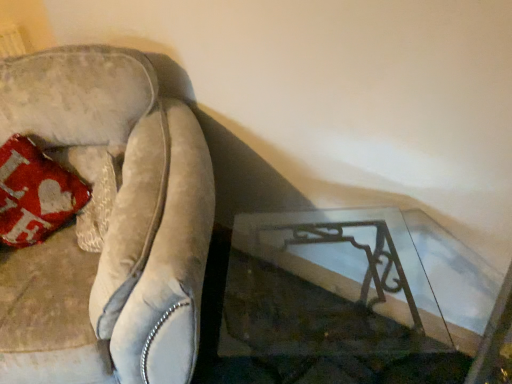
Question: From a real-world perspective, relative to clear glass table at lower right, is velvet couch at left vertically above or below?

Choices:
 (A) above
 (B) below

Answer: (A)

Question: Visually, is velvet couch at left positioned to the left or to the right of clear glass table at lower right?

Choices:
 (A) left
 (B) right

Answer: (A)

Question: Looking at the image, does velvet couch at left seem bigger or smaller compared to clear glass table at lower right?

Choices:
 (A) small
 (B) big

Answer: (B)

Question: Is clear glass table at lower right to the left or to the right of velvet couch at left in the image?

Choices:
 (A) right
 (B) left

Answer: (A)

Question: Considering the positions of clear glass table at lower right and velvet couch at left in the image, is clear glass table at lower right bigger or smaller than velvet couch at left?

Choices:
 (A) small
 (B) big

Answer: (A)

Question: From a real-world perspective, relative to velvet couch at left, is clear glass table at lower right vertically above or below?

Choices:
 (A) above
 (B) below

Answer: (B)

Question: Considering the positions of clear glass table at lower right and velvet couch at left in the image, is clear glass table at lower right taller or shorter than velvet couch at left?

Choices:
 (A) tall
 (B) short

Answer: (B)